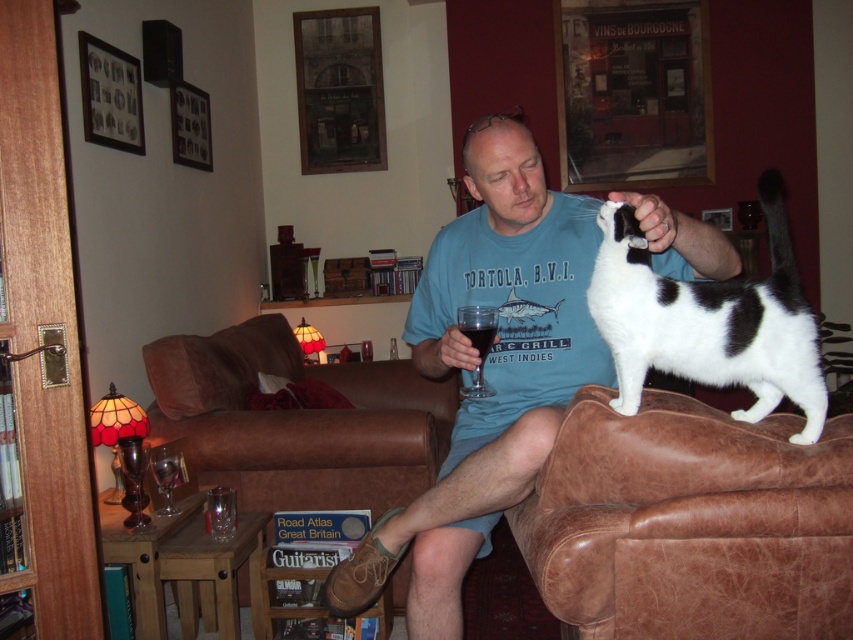
You are a guest in this living room and want to place your bag on the transparent glass at right. Can you do so without moving the brown leather couch at center?

The transparent glass at right is behind the brown leather couch at center, so you cannot reach it without moving the couch.

You are a guest in this living room and want to place a small book on the table between the blue cotton shirt at center and the transparent glass at right. Based on their positions, which object should you place the book closer to?

The blue cotton shirt at center is to the right of the transparent glass at right, so you should place the book closer to the transparent glass at right to ensure it is between both objects.

You are a guest in this living room and want to place a small decorative item on the surface where the clear glass at center is located. Considering the size of the black and white fur at upper right, will there be enough space for your item?

The black and white fur at upper right is larger than the clear glass at center, so there may not be enough space left on the surface of the clear glass at center to place your decorative item.